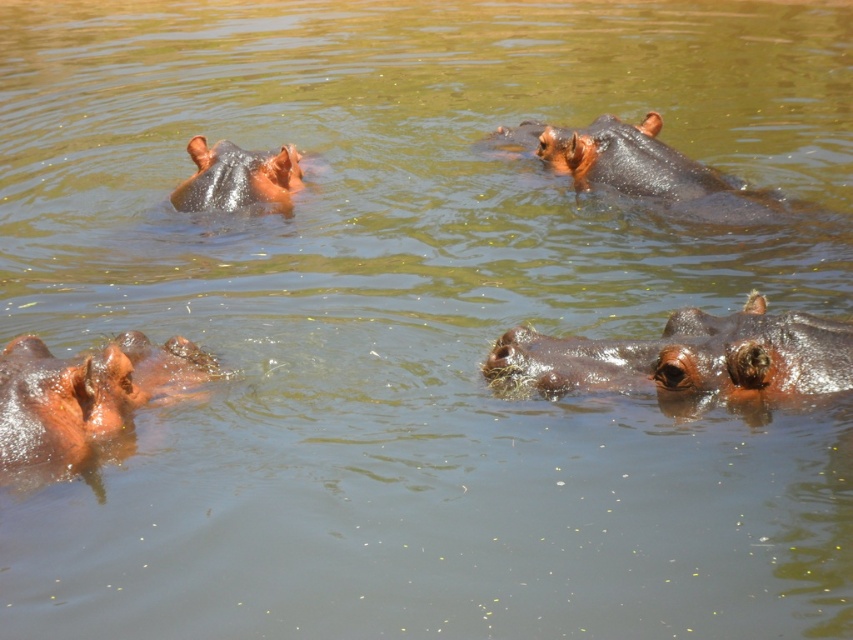
The width and height of the screenshot is (853, 640). In order to click on brown matte hippo at lower right in this screenshot , I will do `click(688, 356)`.

Who is lower down, brown matte hippo at lower right or shiny dark brown hippo at upper right?

brown matte hippo at lower right is lower down.

Is point (538, 333) behind point (708, 172)?

That is False.

Image resolution: width=853 pixels, height=640 pixels. I want to click on brown matte hippo at lower right, so click(688, 356).

Who is positioned more to the right, smooth brown hippo at left or shiny dark brown hippo at upper right?

Positioned to the right is shiny dark brown hippo at upper right.

Does smooth brown hippo at left have a lesser width compared to shiny dark brown hippo at upper right?

Indeed, smooth brown hippo at left has a lesser width compared to shiny dark brown hippo at upper right.

Identify the location of smooth brown hippo at left. (83, 397).

Between brown matte hippo at lower right and brown matte hippo at upper left, which one is positioned higher?

Positioned higher is brown matte hippo at upper left.

Is brown matte hippo at lower right wider than brown matte hippo at upper left?

Yes, brown matte hippo at lower right is wider than brown matte hippo at upper left.

Identify the location of brown matte hippo at lower right. The image size is (853, 640). (688, 356).

The width and height of the screenshot is (853, 640). What are the coordinates of `brown matte hippo at lower right` in the screenshot? It's located at (688, 356).